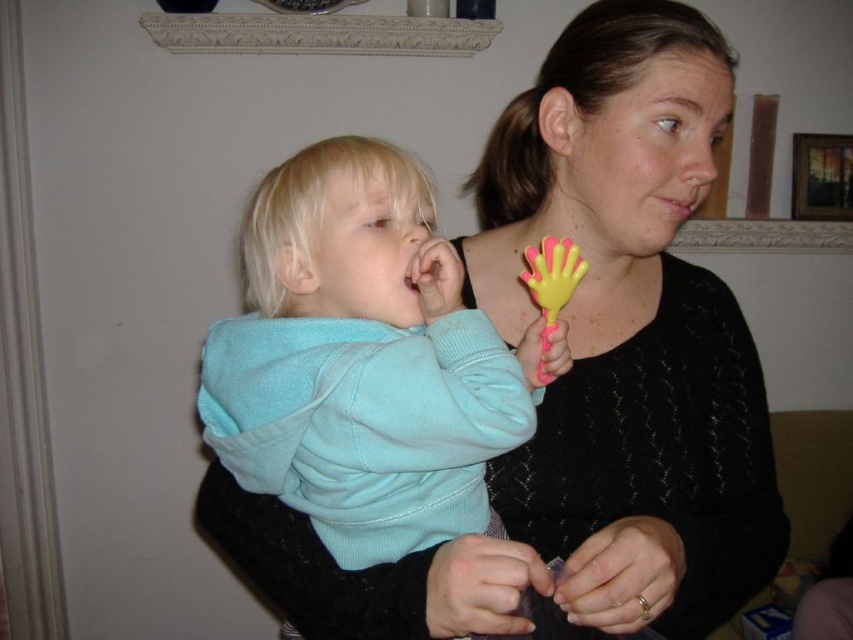
Locate an element on the screen. The height and width of the screenshot is (640, 853). matte black sweater at center is located at coordinates (618, 348).

Does point (538, 131) come behind point (397, 412)?

Yes, point (538, 131) is behind point (397, 412).

Does point (682, 387) come closer to viewer compared to point (434, 324)?

No.

Where is `matte black sweater at center`? matte black sweater at center is located at coordinates (618, 348).

Does matte black sweater at center appear on the left side of yellow rubber toy at center?

No, matte black sweater at center is not to the left of yellow rubber toy at center.

What are the coordinates of `matte black sweater at center` in the screenshot? It's located at (618, 348).

Which is behind, point (260, 419) or point (524, 260)?

Point (524, 260)

Is point (387, 452) farther from viewer compared to point (544, 243)?

No.

Find the location of a particular element. This screenshot has height=640, width=853. light blue fleece sweater at center is located at coordinates (361, 360).